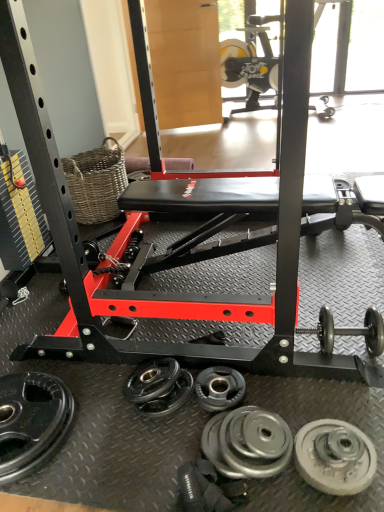
Where is `vacant space behind silver metallic weight plate at lower right, marked as the fourth wheel in a left-to-right arrangement`? The height and width of the screenshot is (512, 384). vacant space behind silver metallic weight plate at lower right, marked as the fourth wheel in a left-to-right arrangement is located at coordinates (315, 401).